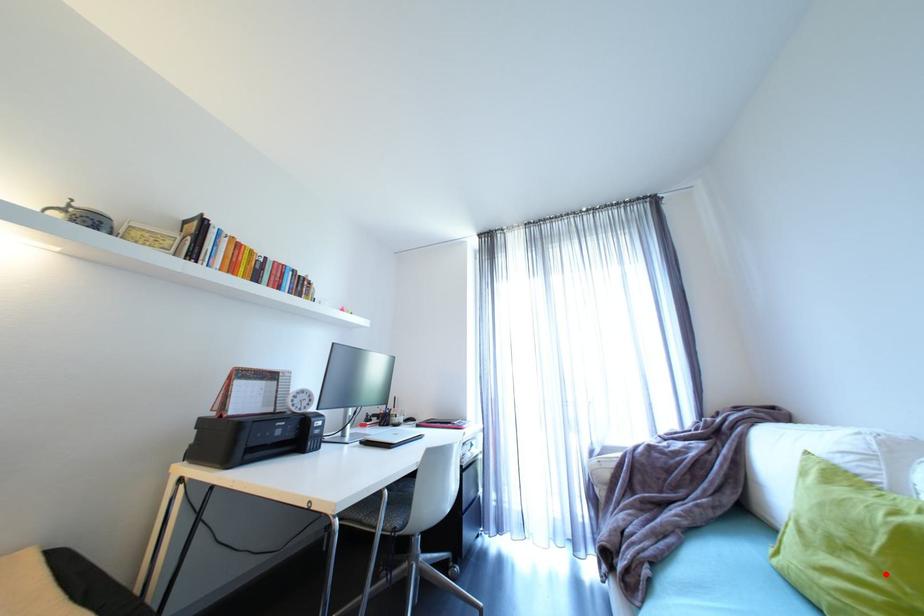
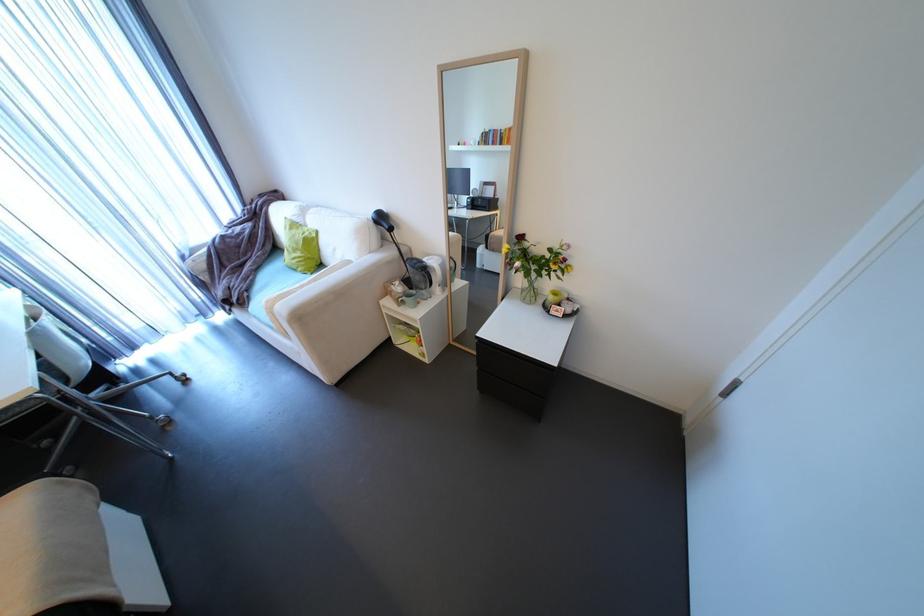
Where in the second image is the point corresponding to the highlighted location from the first image?

(310, 253)